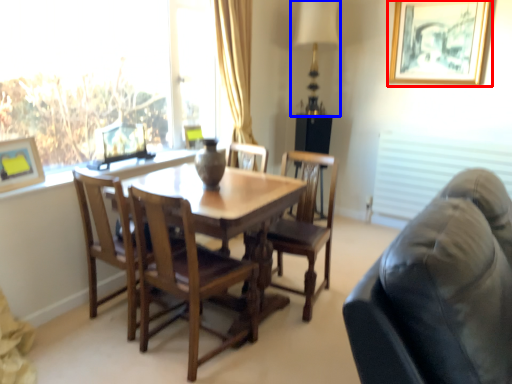
Question: Which object appears farthest to the camera in this image, picture frame (highlighted by a red box) or table lamp (highlighted by a blue box)?

Choices:
 (A) picture frame
 (B) table lamp

Answer: (B)